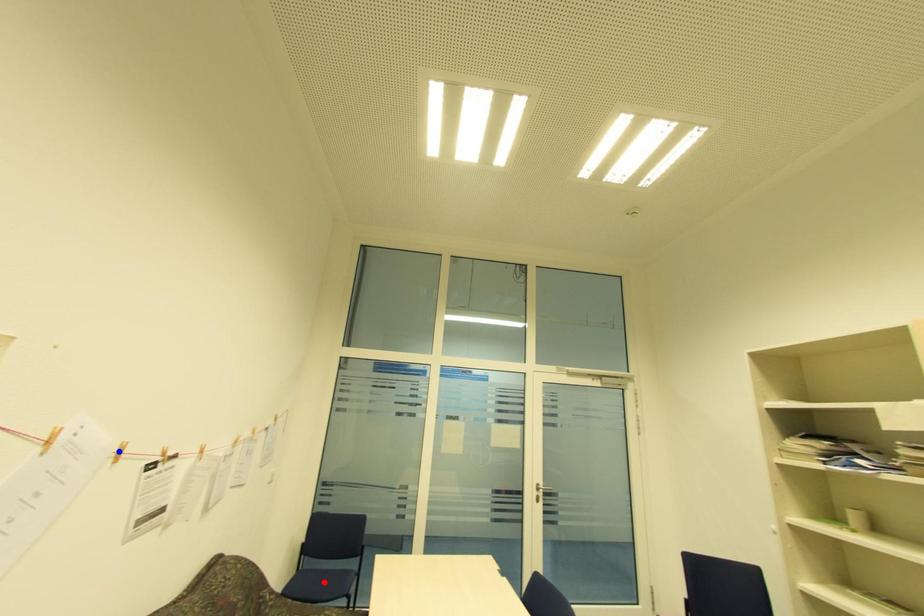
Question: In the image, two points are highlighted. Which point is nearer to the camera? Reply with the corresponding letter.

Choices:
 (A) blue point
 (B) red point

Answer: (A)